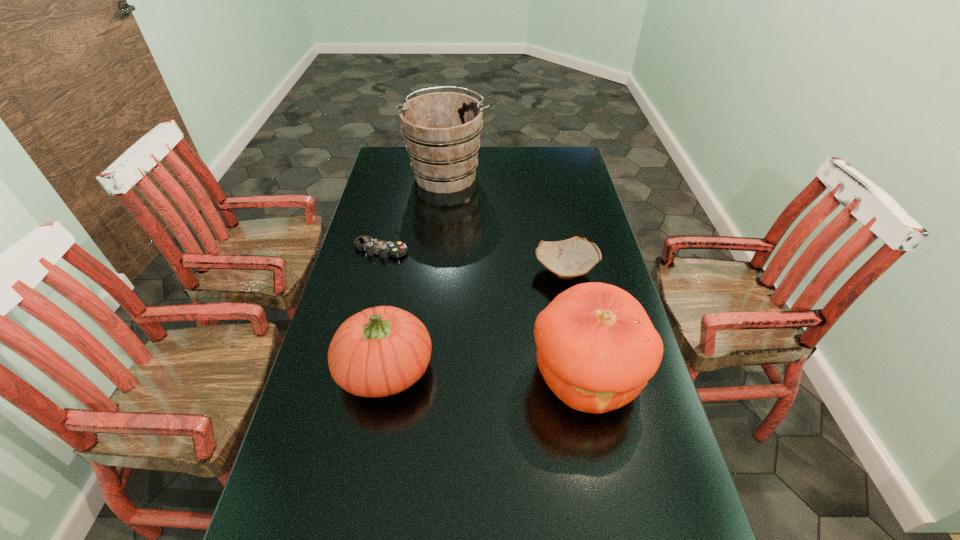
Where is `the farthest object`? The height and width of the screenshot is (540, 960). the farthest object is located at coordinates (442, 130).

Where is `the tallest object`? This screenshot has width=960, height=540. the tallest object is located at coordinates (442, 130).

Where is `the right pumpkin`? The width and height of the screenshot is (960, 540). the right pumpkin is located at coordinates tap(596, 347).

What are the coordinates of `the fourth shortest object` in the screenshot? It's located at (596, 347).

I want to click on the third tallest object, so click(x=380, y=351).

Image resolution: width=960 pixels, height=540 pixels. Identify the location of the left pumpkin. (380, 351).

This screenshot has height=540, width=960. I want to click on pottery, so pyautogui.click(x=570, y=258).

Where is `the shortest object`? The height and width of the screenshot is (540, 960). the shortest object is located at coordinates click(x=384, y=249).

Identify the location of free location located on the left of the taller pumpkin. pyautogui.click(x=402, y=376).

You are a GUI agent. You are given a task and a screenshot of the screen. Output one action in this format:
    pyautogui.click(x=<x>, y=<y>)
    Task: Click on the free space located on the right of the shorter pumpkin
    This screenshot has width=960, height=540.
    Given the screenshot: What is the action you would take?
    pyautogui.click(x=471, y=369)